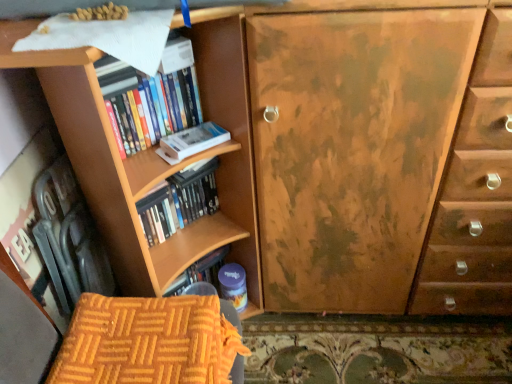
Question: Is hardcover books at left, which is the first book in top-to-bottom order, inside white matte paperback book at upper left?

Choices:
 (A) yes
 (B) no

Answer: (B)

Question: Does white matte paperback book at upper left appear on the right side of hardcover books at left, positioned as the second book in bottom-to-top order?

Choices:
 (A) no
 (B) yes

Answer: (B)

Question: Are white matte paperback book at upper left and hardcover books at left, which is the first book in top-to-bottom order, making contact?

Choices:
 (A) no
 (B) yes

Answer: (A)

Question: Is white matte paperback book at upper left positioned before hardcover books at left, which is the first book in top-to-bottom order?

Choices:
 (A) yes
 (B) no

Answer: (B)

Question: From a real-world perspective, is white matte paperback book at upper left over hardcover books at left, positioned as the second book in bottom-to-top order?

Choices:
 (A) yes
 (B) no

Answer: (B)

Question: Is orange quilted fabric armchair at lower left taller or shorter than white matte paperback book at upper left?

Choices:
 (A) short
 (B) tall

Answer: (B)

Question: Which is correct: orange quilted fabric armchair at lower left is inside white matte paperback book at upper left, or outside of it?

Choices:
 (A) inside
 (B) outside

Answer: (B)

Question: Considering the positions of orange quilted fabric armchair at lower left and white matte paperback book at upper left in the image, is orange quilted fabric armchair at lower left bigger or smaller than white matte paperback book at upper left?

Choices:
 (A) big
 (B) small

Answer: (A)

Question: Is orange quilted fabric armchair at lower left wider or thinner than white matte paperback book at upper left?

Choices:
 (A) wide
 (B) thin

Answer: (A)

Question: Is hardcover books at left, positioned as the second book in bottom-to-top order, situated inside white matte paperback book at upper left or outside?

Choices:
 (A) outside
 (B) inside

Answer: (A)

Question: From the image's perspective, is hardcover books at left, positioned as the second book in bottom-to-top order, located above or below white matte paperback book at upper left?

Choices:
 (A) above
 (B) below

Answer: (A)

Question: Relative to white matte paperback book at upper left, is hardcover books at left, which is the first book in top-to-bottom order, in front or behind?

Choices:
 (A) behind
 (B) front

Answer: (B)

Question: Does point (147, 115) appear closer or farther from the camera than point (214, 127)?

Choices:
 (A) closer
 (B) farther

Answer: (A)

Question: Considering the relative positions of hardcover books at left, which is the first book in top-to-bottom order, and orange quilted fabric armchair at lower left in the image provided, is hardcover books at left, which is the first book in top-to-bottom order, to the left or to the right of orange quilted fabric armchair at lower left?

Choices:
 (A) right
 (B) left

Answer: (B)

Question: Is hardcover books at left, positioned as the second book in bottom-to-top order, inside or outside of orange quilted fabric armchair at lower left?

Choices:
 (A) inside
 (B) outside

Answer: (B)